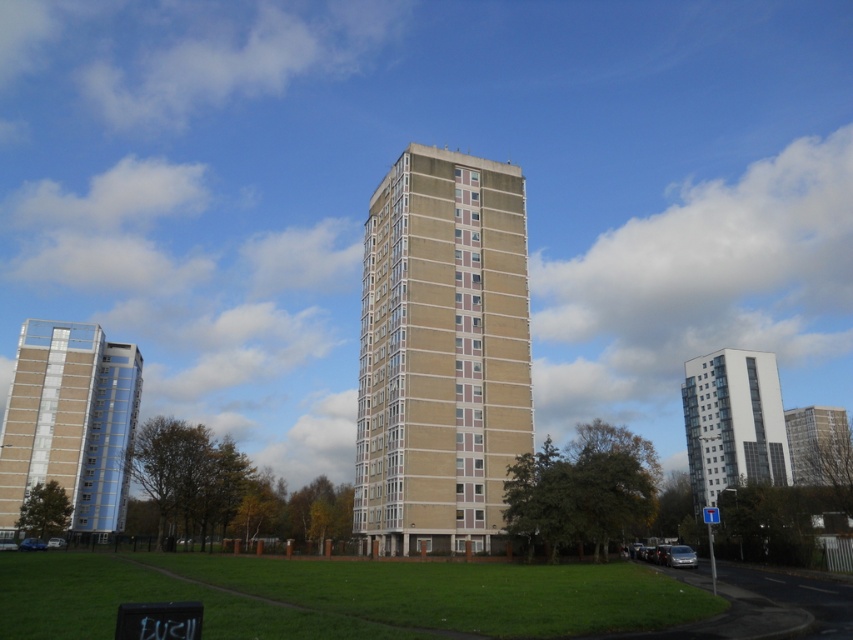
Between beige concrete tower at center and white glass building at upper center, which one is positioned lower?

white glass building at upper center is below.

Who is taller, beige concrete tower at center or white glass building at upper center?

Standing taller between the two is beige concrete tower at center.

Between point (479, 490) and point (706, 356), which one is positioned behind?

The point (706, 356) is more distant.

Where is `beige concrete tower at center`? beige concrete tower at center is located at coordinates (440, 352).

Which is more to the left, metallic glass tower at left or white glass building at upper center?

From the viewer's perspective, metallic glass tower at left appears more on the left side.

In order to click on metallic glass tower at left in this screenshot , I will do `click(70, 422)`.

You are a GUI agent. You are given a task and a screenshot of the screen. Output one action in this format:
    pyautogui.click(x=<x>, y=<y>)
    Task: Click on the metallic glass tower at left
    This screenshot has height=640, width=853.
    Given the screenshot: What is the action you would take?
    pyautogui.click(x=70, y=422)

Can you confirm if beige concrete tower at center is positioned to the left of metallic glass tower at left?

Incorrect, beige concrete tower at center is not on the left side of metallic glass tower at left.

Is beige concrete tower at center shorter than metallic glass tower at left?

In fact, beige concrete tower at center may be taller than metallic glass tower at left.

Describe the element at coordinates (440, 352) in the screenshot. I see `beige concrete tower at center` at that location.

I want to click on beige concrete tower at center, so click(440, 352).